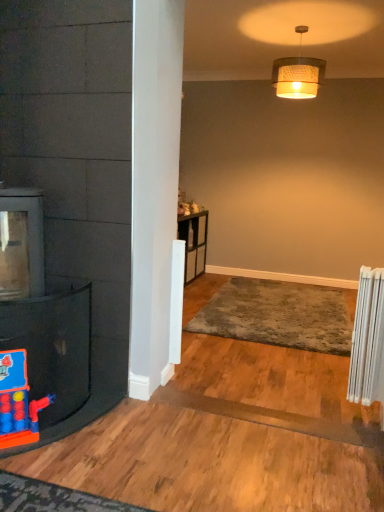
This screenshot has height=512, width=384. I want to click on woven fabric lampshade at upper center, so click(x=298, y=74).

Would you say rubberized plastic toy at left is part of white plastic radiator at right's contents?

No, rubberized plastic toy at left is not surrounded by white plastic radiator at right.

Considering the relative sizes of white plastic radiator at right and rubberized plastic toy at left in the image provided, is white plastic radiator at right wider than rubberized plastic toy at left?

Correct, the width of white plastic radiator at right exceeds that of rubberized plastic toy at left.

Based on the photo, is white plastic radiator at right in front of rubberized plastic toy at left?

No, it is not.

Based on their positions, is white plastic radiator at right located to the left or right of rubberized plastic toy at left?

From the image, it's evident that white plastic radiator at right is to the right of rubberized plastic toy at left.

Considering the sizes of objects rubberized plastic toy at left and gray plush rug at center in the image provided, who is taller, rubberized plastic toy at left or gray plush rug at center?

Standing taller between the two is rubberized plastic toy at left.

You are a GUI agent. You are given a task and a screenshot of the screen. Output one action in this format:
    pyautogui.click(x=<x>, y=<y>)
    Task: Click on the toy on the left of the gray plush rug at center
    
    Given the screenshot: What is the action you would take?
    pyautogui.click(x=18, y=402)

Are rubberized plastic toy at left and gray plush rug at center far apart?

rubberized plastic toy at left is far away from gray plush rug at center.

Looking at the image, does rubberized plastic toy at left seem bigger or smaller compared to gray plush rug at center?

In the image, rubberized plastic toy at left appears to be smaller than gray plush rug at center.

Does rubberized plastic toy at left have a smaller size compared to woven fabric lampshade at upper center?

Correct, rubberized plastic toy at left occupies less space than woven fabric lampshade at upper center.

From the image's perspective, which is below, rubberized plastic toy at left or woven fabric lampshade at upper center?

rubberized plastic toy at left, from the image's perspective.

Is white plastic radiator at right not near woven fabric lampshade at upper center?

Yes, white plastic radiator at right is far from woven fabric lampshade at upper center.

Which of these two, white plastic radiator at right or woven fabric lampshade at upper center, stands shorter?

With less height is woven fabric lampshade at upper center.

Does white plastic radiator at right have a lesser width compared to woven fabric lampshade at upper center?

Indeed, white plastic radiator at right has a lesser width compared to woven fabric lampshade at upper center.

From the picture: Could you tell me if white plastic radiator at right is turned towards woven fabric lampshade at upper center?

No, white plastic radiator at right is not aimed at woven fabric lampshade at upper center.

How different are the orientations of woven fabric lampshade at upper center and white plastic radiator at right in degrees?

The facing directions of woven fabric lampshade at upper center and white plastic radiator at right are 102 degrees apart.

From their relative heights in the image, would you say woven fabric lampshade at upper center is taller or shorter than white plastic radiator at right?

Clearly, woven fabric lampshade at upper center is shorter compared to white plastic radiator at right.

Is white plastic radiator at right completely or partially inside woven fabric lampshade at upper center?

No.

Is woven fabric lampshade at upper center in front of or behind white plastic radiator at right in the image?

In the image, woven fabric lampshade at upper center appears behind white plastic radiator at right.

Looking at this image, considering the sizes of objects gray plush rug at center and woven fabric lampshade at upper center in the image provided, who is shorter, gray plush rug at center or woven fabric lampshade at upper center?

gray plush rug at center.

From the picture: Based on their positions, is gray plush rug at center located to the left or right of woven fabric lampshade at upper center?

In the image, gray plush rug at center appears on the left side of woven fabric lampshade at upper center.

Looking at this image, which object is closer to the camera, gray plush rug at center or woven fabric lampshade at upper center?

gray plush rug at center.

Which object is wider, gray plush rug at center or woven fabric lampshade at upper center?

gray plush rug at center is wider.

Can you confirm if rubberized plastic toy at left is bigger than white plastic radiator at right?

No.

Is rubberized plastic toy at left aimed at white plastic radiator at right?

No, rubberized plastic toy at left is not oriented towards white plastic radiator at right.

Considering the positions of objects rubberized plastic toy at left and white plastic radiator at right in the image provided, who is more to the right, rubberized plastic toy at left or white plastic radiator at right?

From the viewer's perspective, white plastic radiator at right appears more on the right side.

Considering the sizes of rubberized plastic toy at left and white plastic radiator at right in the image, is rubberized plastic toy at left wider or thinner than white plastic radiator at right?

Considering their sizes, rubberized plastic toy at left looks slimmer than white plastic radiator at right.

Locate an element on the screen. The image size is (384, 512). toy located on the left of white plastic radiator at right is located at coordinates (18, 402).

Locate an element on the screen. toy in front of the gray plush rug at center is located at coordinates (18, 402).

Looking at this image, considering their positions, is gray plush rug at center positioned closer to rubberized plastic toy at left than white plastic radiator at right?

white plastic radiator at right lies closer to rubberized plastic toy at left than the other object.

Looking at the image, which one is located closer to rubberized plastic toy at left, white plastic radiator at right or woven fabric lampshade at upper center?

white plastic radiator at right is positioned closer to the anchor rubberized plastic toy at left.

Based on the photo, considering their positions, is gray plush rug at center positioned closer to woven fabric lampshade at upper center than white plastic radiator at right?

The object closer to woven fabric lampshade at upper center is gray plush rug at center.

From the image, which object appears to be farther from gray plush rug at center, woven fabric lampshade at upper center or rubberized plastic toy at left?

The object further to gray plush rug at center is rubberized plastic toy at left.

Which object lies nearer to the anchor point white plastic radiator at right, gray plush rug at center or woven fabric lampshade at upper center?

gray plush rug at center.

Based on their spatial positions, is woven fabric lampshade at upper center or gray plush rug at center further from rubberized plastic toy at left?

Among the two, woven fabric lampshade at upper center is located further to rubberized plastic toy at left.

From the image, which object appears to be farther from white plastic radiator at right, rubberized plastic toy at left or gray plush rug at center?

rubberized plastic toy at left is further to white plastic radiator at right.

When comparing their distances from gray plush rug at center, does rubberized plastic toy at left or woven fabric lampshade at upper center seem closer?

woven fabric lampshade at upper center is closer to gray plush rug at center.

I want to click on radiator between woven fabric lampshade at upper center and rubberized plastic toy at left from top to bottom, so (x=367, y=338).

Find the location of a particular element. Image resolution: width=384 pixels, height=512 pixels. plain between woven fabric lampshade at upper center and rubberized plastic toy at left in the up-down direction is located at coordinates (277, 315).

I want to click on radiator between woven fabric lampshade at upper center and gray plush rug at center in the vertical direction, so click(x=367, y=338).

At what (x,y) coordinates should I click in order to perform the action: click on plain between rubberized plastic toy at left and white plastic radiator at right from left to right. Please return your answer as a coordinate pair (x, y). The image size is (384, 512). Looking at the image, I should click on (277, 315).